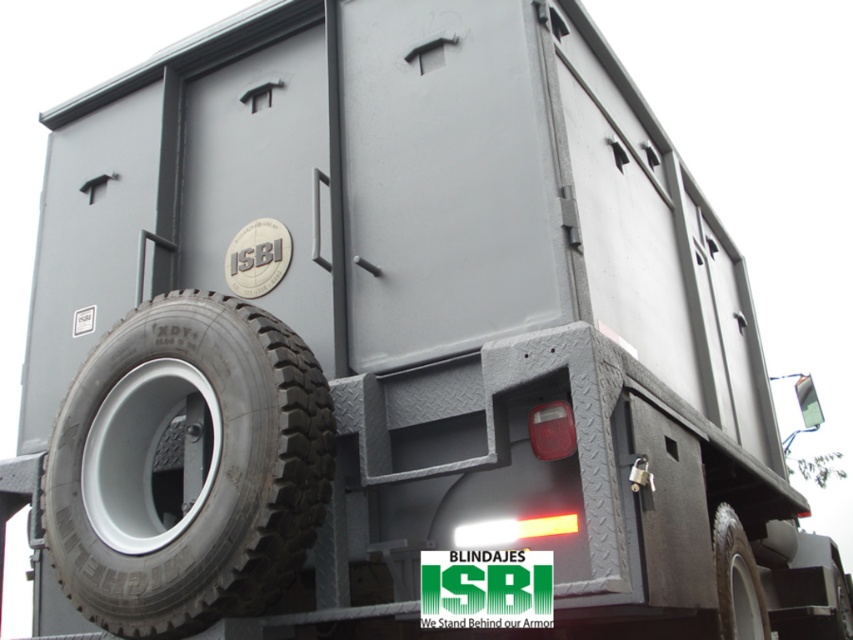
Question: Which point is closer to the camera?

Choices:
 (A) (224, 445)
 (B) (740, 609)

Answer: (A)

Question: Is black rubber tire at lower left smaller than black rubber tire at lower right?

Choices:
 (A) yes
 (B) no

Answer: (B)

Question: Which object appears farthest from the camera in this image?

Choices:
 (A) black rubber tire at lower left
 (B) black rubber tire at lower right

Answer: (B)

Question: Is black rubber tire at lower left above black rubber tire at lower right?

Choices:
 (A) no
 (B) yes

Answer: (B)

Question: Can you confirm if black rubber tire at lower left is positioned to the left of black rubber tire at lower right?

Choices:
 (A) no
 (B) yes

Answer: (B)